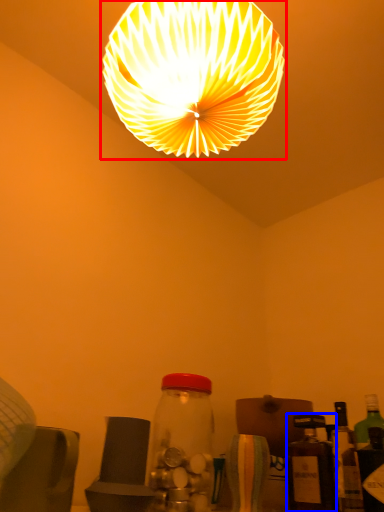
Question: Which point is closer to the camera, lamp (highlighted by a red box) or bottle (highlighted by a blue box)?

Choices:
 (A) lamp
 (B) bottle

Answer: (A)